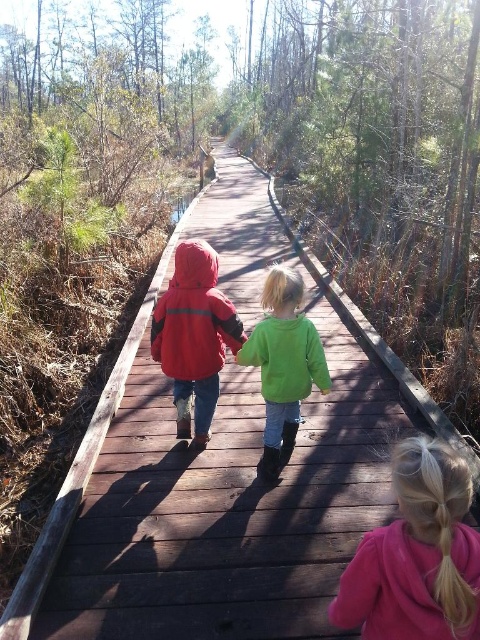
Question: Which of these objects is positioned closest to the matte red jacket at center?

Choices:
 (A) pink fleece jacket at lower right
 (B) green fleece jacket at center

Answer: (B)

Question: Observing the image, what is the correct spatial positioning of matte red jacket at center in reference to green fleece jacket at center?

Choices:
 (A) below
 (B) above

Answer: (B)

Question: Is the position of green fuzzy sweater at center less distant than that of green fleece jacket at center?

Choices:
 (A) yes
 (B) no

Answer: (A)

Question: Is matte red jacket at center positioned in front of green fleece jacket at center?

Choices:
 (A) yes
 (B) no

Answer: (B)

Question: Among these points, which one is farthest from the camera?

Choices:
 (A) (207, 317)
 (B) (448, 625)
 (C) (268, 388)
 (D) (283, 349)

Answer: (A)

Question: Among these objects, which one is farthest from the camera?

Choices:
 (A) green fleece jacket at center
 (B) matte red jacket at center
 (C) pink fleece jacket at lower right
 (D) green fuzzy sweater at center

Answer: (B)